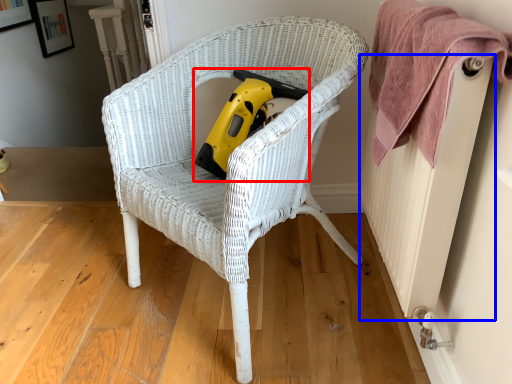
Question: Which object is closer to the camera taking this photo, vacuum (highlighted by a red box) or radiator (highlighted by a blue box)?

Choices:
 (A) vacuum
 (B) radiator

Answer: (B)